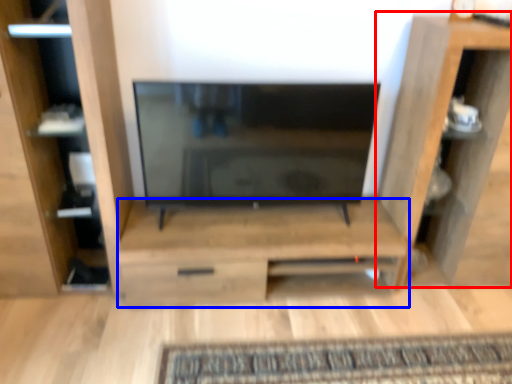
Question: Among these objects, which one is farthest to the camera, shelf (highlighted by a red box) or cabinetry (highlighted by a blue box)?

Choices:
 (A) shelf
 (B) cabinetry

Answer: (B)